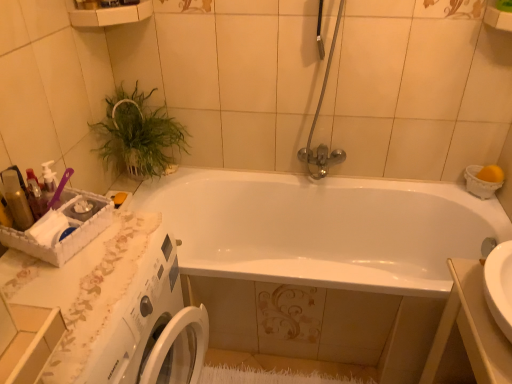
Question: Does green leafy plant at upper left have a lesser height compared to shiny plastic bottles at left?

Choices:
 (A) yes
 (B) no

Answer: (B)

Question: Considering the relative sizes of green leafy plant at upper left and shiny plastic bottles at left in the image provided, is green leafy plant at upper left bigger than shiny plastic bottles at left?

Choices:
 (A) no
 (B) yes

Answer: (B)

Question: From a real-world perspective, is green leafy plant at upper left beneath shiny plastic bottles at left?

Choices:
 (A) yes
 (B) no

Answer: (A)

Question: Could shiny plastic bottles at left be considered to be inside green leafy plant at upper left?

Choices:
 (A) no
 (B) yes

Answer: (A)

Question: Is green leafy plant at upper left smaller than shiny plastic bottles at left?

Choices:
 (A) no
 (B) yes

Answer: (A)

Question: Is green leafy plant at upper left wider than shiny plastic bottles at left?

Choices:
 (A) no
 (B) yes

Answer: (B)

Question: Is chrome metallic shower door at upper center closer to the viewer compared to white lace counter top at lower left?

Choices:
 (A) no
 (B) yes

Answer: (A)

Question: Does chrome metallic shower door at upper center have a larger size compared to white lace counter top at lower left?

Choices:
 (A) no
 (B) yes

Answer: (A)

Question: From a real-world perspective, is chrome metallic shower door at upper center located higher than white lace counter top at lower left?

Choices:
 (A) yes
 (B) no

Answer: (A)

Question: Are chrome metallic shower door at upper center and white lace counter top at lower left far apart?

Choices:
 (A) yes
 (B) no

Answer: (A)

Question: Does chrome metallic shower door at upper center appear on the left side of white lace counter top at lower left?

Choices:
 (A) no
 (B) yes

Answer: (A)

Question: From a real-world perspective, does chrome metallic shower door at upper center sit lower than white lace counter top at lower left?

Choices:
 (A) yes
 (B) no

Answer: (B)

Question: Does white glossy bathtub at center appear on the right side of white glossy sink at lower right?

Choices:
 (A) no
 (B) yes

Answer: (A)